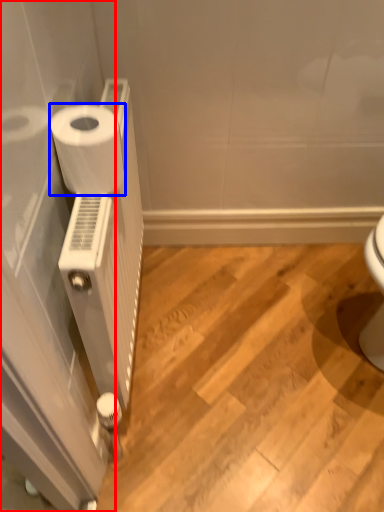
Question: Which object is closer to the camera taking this photo, screen door (highlighted by a red box) or toilet paper (highlighted by a blue box)?

Choices:
 (A) screen door
 (B) toilet paper

Answer: (A)